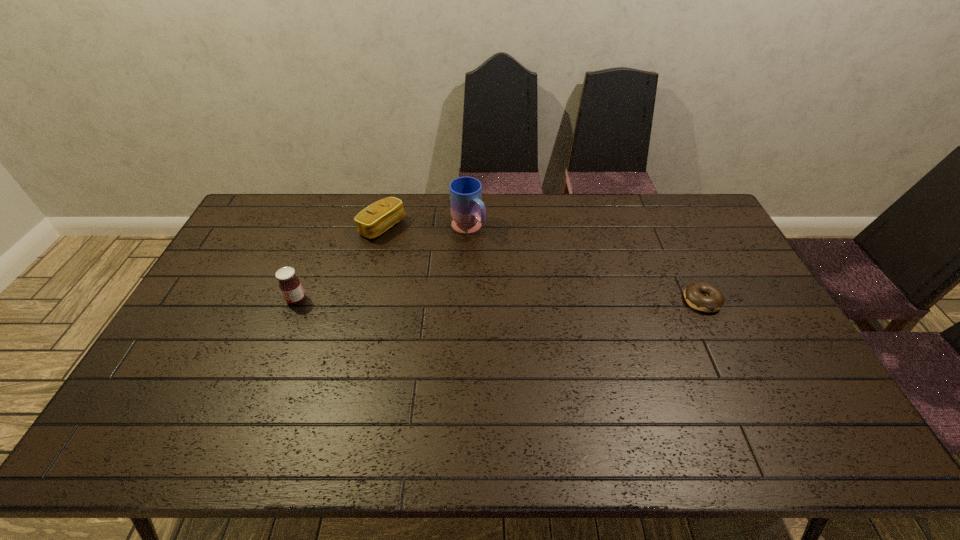
At what (x,y) coordinates should I click in order to perform the action: click on jam. Please return your answer as a coordinate pair (x, y). This screenshot has height=540, width=960. Looking at the image, I should click on (290, 285).

At what (x,y) coordinates should I click in order to perform the action: click on the third shortest object. Please return your answer as a coordinate pair (x, y). The image size is (960, 540). Looking at the image, I should click on pos(290,285).

At what (x,y) coordinates should I click in order to perform the action: click on the shortest object. Please return your answer as a coordinate pair (x, y). Looking at the image, I should click on (701, 296).

Where is `doughnut`? The height and width of the screenshot is (540, 960). doughnut is located at coordinates 701,296.

Where is `the tallest object`? The image size is (960, 540). the tallest object is located at coordinates (468, 212).

Image resolution: width=960 pixels, height=540 pixels. Identify the location of the third object from left to right. coord(468,212).

Find the location of a particular element. The image size is (960, 540). clutch bag is located at coordinates (380, 216).

I want to click on the second object from left to right, so click(x=380, y=216).

This screenshot has height=540, width=960. Find the location of `vacant space situated 0.100m on the label side of the third shortest object`. vacant space situated 0.100m on the label side of the third shortest object is located at coordinates (253, 299).

What are the coordinates of `free space located on the label side of the third shortest object` in the screenshot? It's located at (221, 299).